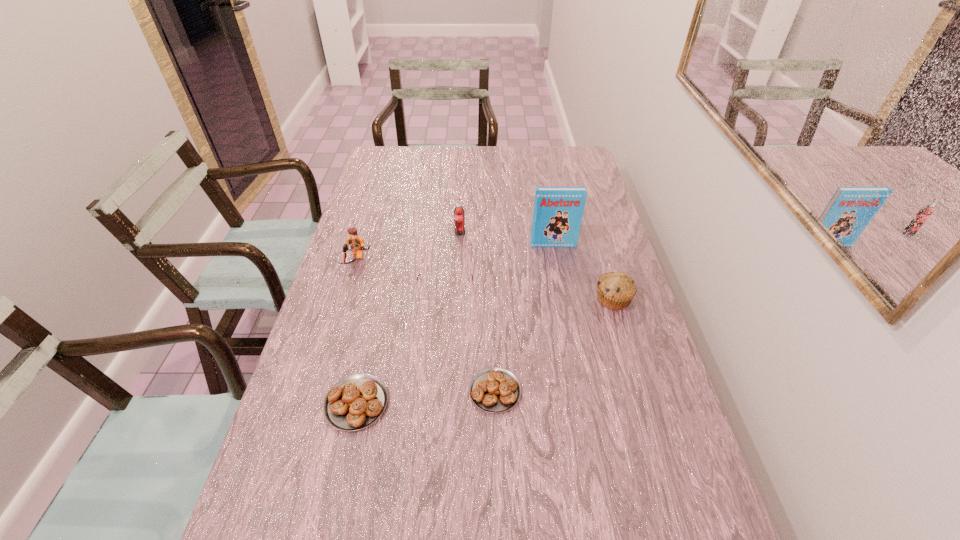
At what (x,y) coordinates should I click in order to perform the action: click on soda bottle. Please return your answer as a coordinate pair (x, y). Image resolution: width=960 pixels, height=540 pixels. Looking at the image, I should click on (459, 219).

At what (x,y) coordinates should I click in order to perform the action: click on the fourth tallest object. Please return your answer as a coordinate pair (x, y). The width and height of the screenshot is (960, 540). Looking at the image, I should click on (615, 290).

Locate an element on the screen. the rightmost object is located at coordinates (615, 290).

This screenshot has width=960, height=540. Find the location of `vacant space situated 0.280m on the back of the sixth tallest object`. vacant space situated 0.280m on the back of the sixth tallest object is located at coordinates (381, 294).

Locate an element on the screen. The height and width of the screenshot is (540, 960). vacant position located 0.210m on the front of the shorter pastry is located at coordinates (498, 513).

Image resolution: width=960 pixels, height=540 pixels. Identify the location of free location located on the front cover of the sixth object from left to right. (570, 334).

Locate an element on the screen. This screenshot has height=540, width=960. vacant space located 0.390m holding a crossbow in the hands of the third tallest object is located at coordinates (318, 380).

Locate an element on the screen. vacant area situated 0.380m on the front-facing side of the spectacles is located at coordinates (x=432, y=450).

The image size is (960, 540). I want to click on vacant space located on the label of the soda bottle, so click(x=459, y=256).

At what (x,y) coordinates should I click in order to perform the action: click on vacant space located on the front of the rightmost object. Please return your answer as a coordinate pair (x, y). Image resolution: width=960 pixels, height=540 pixels. Looking at the image, I should click on (629, 352).